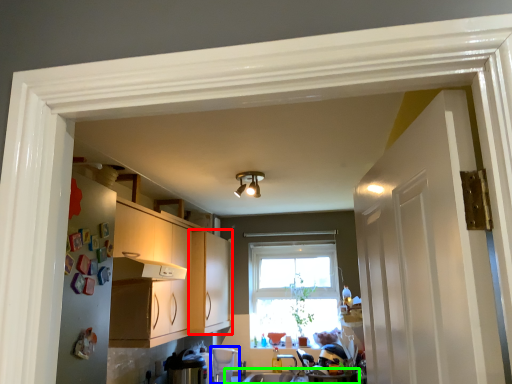
Question: Which object is positioned farthest from cabinetry (highlighted by a red box)? Select from appliance (highlighted by a blue box) and counter top (highlighted by a green box).

Choices:
 (A) appliance
 (B) counter top

Answer: (B)